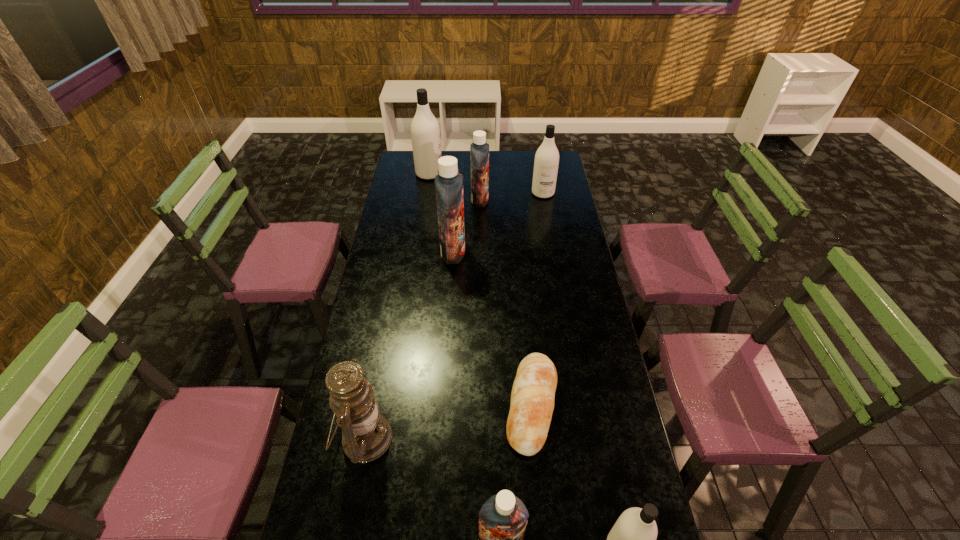
You are a GUI agent. You are given a task and a screenshot of the screen. Output one action in this format:
    pyautogui.click(x=<x>, y=<y>)
    Task: Click on the free space at the far edge of the desktop
    The height and width of the screenshot is (540, 960).
    Given the screenshot: What is the action you would take?
    pyautogui.click(x=498, y=167)

Find the location of a particular element. Image resolution: width=960 pixels, height=540 pixels. vacant region at the left edge of the desktop is located at coordinates (365, 478).

Image resolution: width=960 pixels, height=540 pixels. In the image, there is a desktop. Find the location of `vacant space at the right edge`. vacant space at the right edge is located at coordinates (565, 252).

In the image, there is a desktop. Where is `vacant region at the far left corner`? This screenshot has height=540, width=960. vacant region at the far left corner is located at coordinates (413, 173).

The height and width of the screenshot is (540, 960). Identify the location of free space between the fourth farthest shampoo and the second farthest white shampoo. (498, 222).

At what (x,y) coordinates should I click in order to perform the action: click on vacant area that lies between the second smallest blue shampoo and the oil lamp. Please return your answer as a coordinate pair (x, y). Looking at the image, I should click on (422, 319).

You are a GUI agent. You are given a task and a screenshot of the screen. Output one action in this format:
    pyautogui.click(x=<x>, y=<y>)
    Task: Click on the free space between the second biggest blue shampoo and the oil lamp
    
    Given the screenshot: What is the action you would take?
    (422, 319)

Where is `object that is the fifth closest one to the nearest white shampoo`? The width and height of the screenshot is (960, 540). object that is the fifth closest one to the nearest white shampoo is located at coordinates (479, 150).

Choose which object is the sixth nearest neighbor to the bread. Please provide its 2D coordinates. Your answer should be formatted as a tuple, i.e. [(x, y)], where the tuple contains the x and y coordinates of a point satisfying the conditions above.

[(546, 162)]

You are a GUI agent. You are given a task and a screenshot of the screen. Output one action in this format:
    pyautogui.click(x=<x>, y=<y>)
    Task: Click on the shampoo that stands as the fifth closest to the leftmost shampoo
    
    Given the screenshot: What is the action you would take?
    pyautogui.click(x=632, y=539)